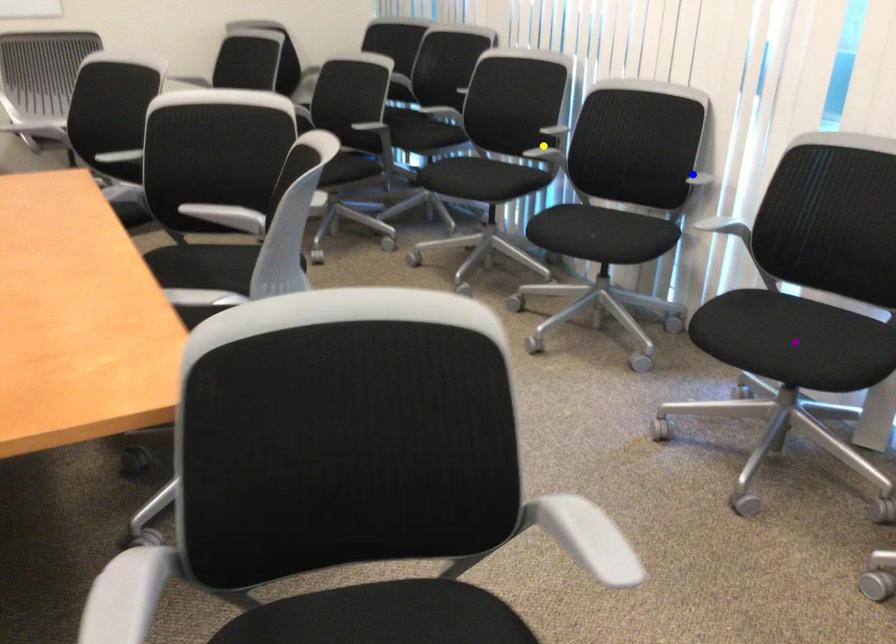
Looking at this image, order these from nearest to farthest:
purple point, blue point, yellow point

purple point, blue point, yellow point